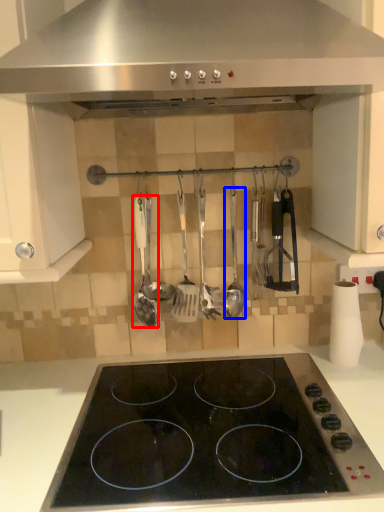
Question: Which object appears closest to the camera in this image, spatula (highlighted by a red box) or spatula (highlighted by a blue box)?

Choices:
 (A) spatula
 (B) spatula

Answer: (A)